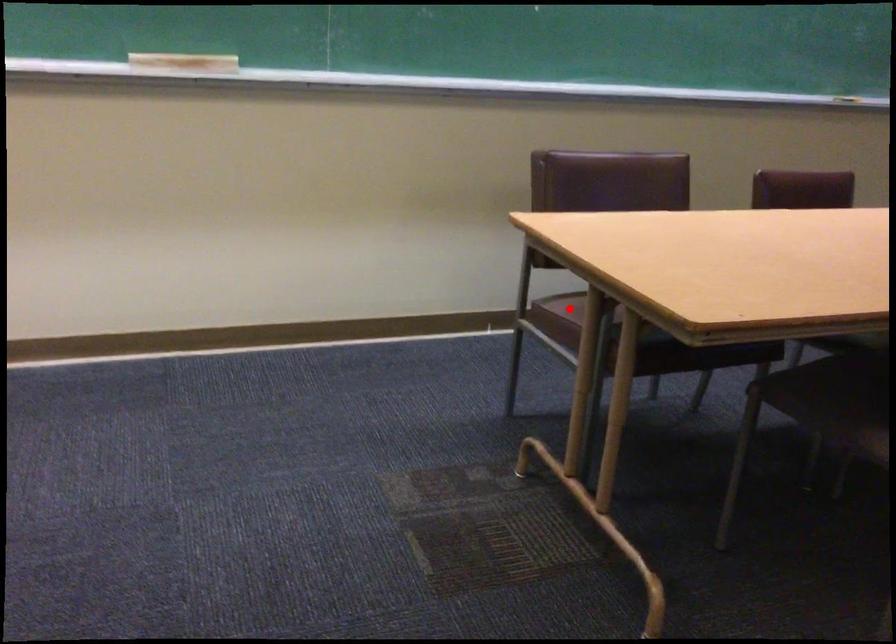
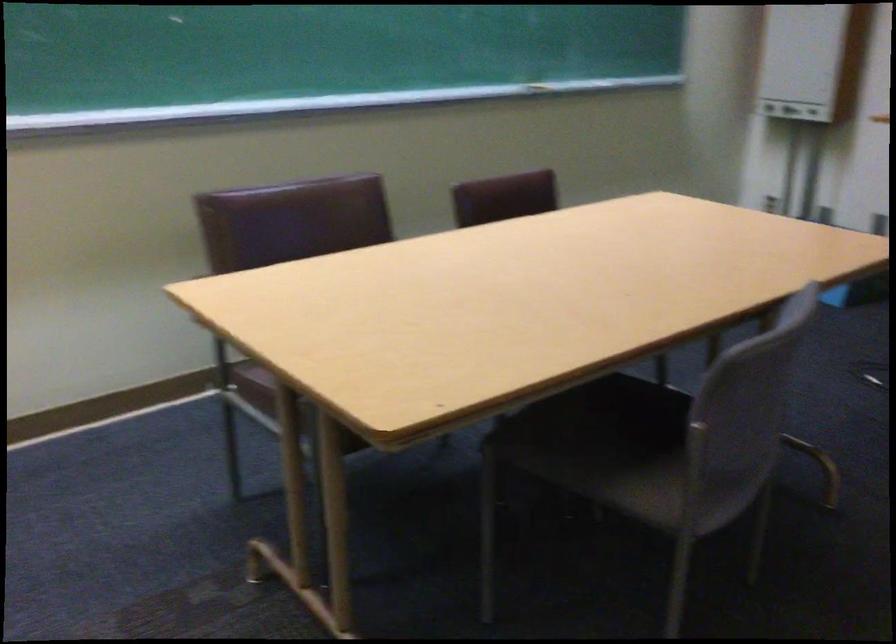
Question: I am providing you with two images of the same scene from different viewpoints. A red point is shown in image1. For the corresponding object point in image2, is it positioned nearer or farther from the camera?

Choices:
 (A) Nearer
 (B) Farther

Answer: (A)